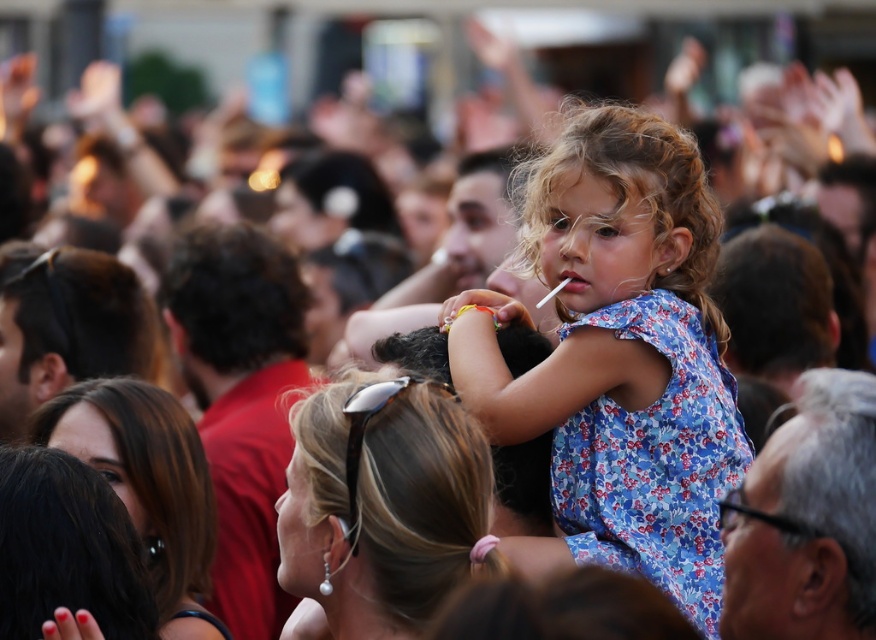
Question: Which point is closer to the camera taking this photo?

Choices:
 (A) (625, 212)
 (B) (864, 616)
 (C) (564, 278)
 (D) (358, 426)

Answer: (B)

Question: Which point is closer to the camera?

Choices:
 (A) (64, 452)
 (B) (583, 161)
 (C) (154, 499)

Answer: (A)

Question: Is brown shiny hair at center positioned at the back of curly blonde hair at center?

Choices:
 (A) yes
 (B) no

Answer: (B)

Question: Among these points, which one is farthest from the camera?

Choices:
 (A) (583, 280)
 (B) (796, 444)

Answer: (A)

Question: Can you confirm if brown shiny hair at center is bigger than dark brown hair at lower left?

Choices:
 (A) yes
 (B) no

Answer: (A)

Question: Is blue floral dress at center bigger than yellow rubber band at center?

Choices:
 (A) no
 (B) yes

Answer: (B)